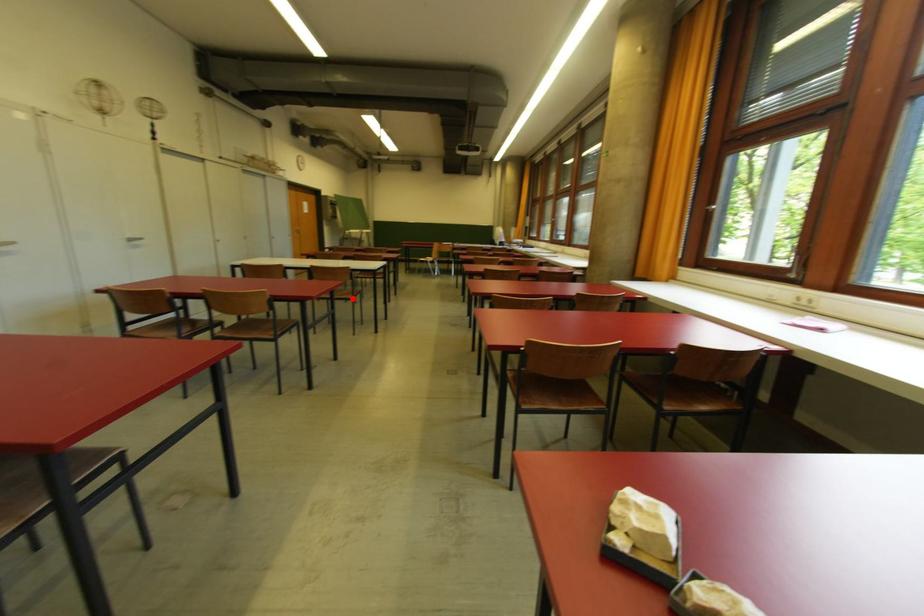
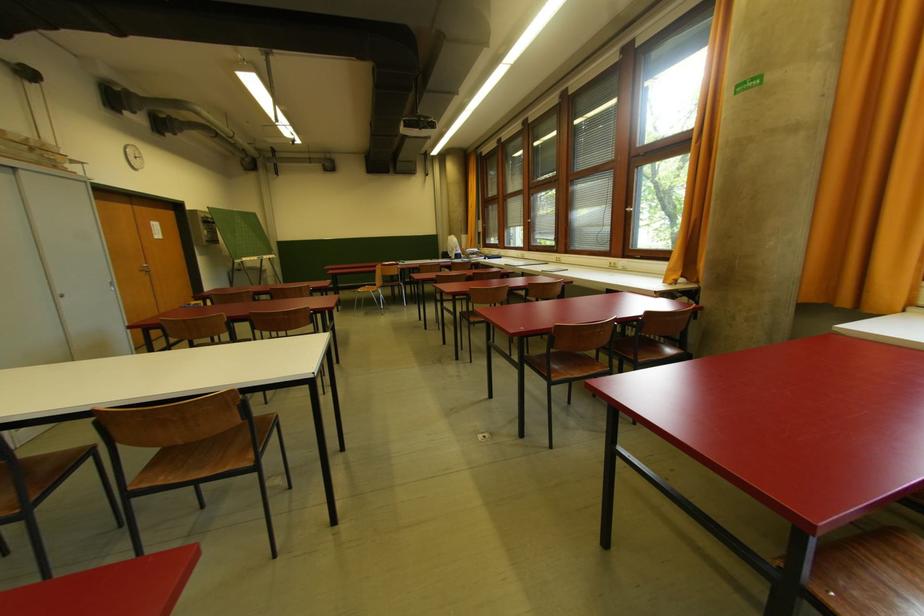
Where in the second image is the point corresponding to the highlighted location from the first image?

(250, 467)